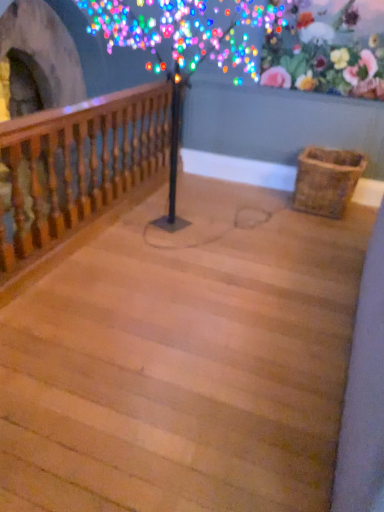
Question: Is floral fabric at upper right positioned beyond the bounds of wooden stairs at center?

Choices:
 (A) no
 (B) yes

Answer: (B)

Question: Considering the relative sizes of floral fabric at upper right and wooden stairs at center in the image provided, is floral fabric at upper right taller than wooden stairs at center?

Choices:
 (A) no
 (B) yes

Answer: (B)

Question: Is floral fabric at upper right wider than wooden stairs at center?

Choices:
 (A) no
 (B) yes

Answer: (A)

Question: From a real-world perspective, does floral fabric at upper right sit lower than wooden stairs at center?

Choices:
 (A) yes
 (B) no

Answer: (B)

Question: Does floral fabric at upper right appear on the left side of wooden stairs at center?

Choices:
 (A) no
 (B) yes

Answer: (A)

Question: From the image's perspective, is woven brown basket at lower right positioned above or below wooden stairs at center?

Choices:
 (A) below
 (B) above

Answer: (B)

Question: Considering the positions of point (314, 199) and point (279, 450), is point (314, 199) closer or farther from the camera than point (279, 450)?

Choices:
 (A) farther
 (B) closer

Answer: (A)

Question: Considering the positions of woven brown basket at lower right and wooden stairs at center in the image, is woven brown basket at lower right taller or shorter than wooden stairs at center?

Choices:
 (A) short
 (B) tall

Answer: (B)

Question: Based on their sizes in the image, would you say woven brown basket at lower right is bigger or smaller than wooden stairs at center?

Choices:
 (A) small
 (B) big

Answer: (A)

Question: From their relative heights in the image, would you say floral fabric at upper right is taller or shorter than wooden baluster at left?

Choices:
 (A) short
 (B) tall

Answer: (A)

Question: Is floral fabric at upper right wider or thinner than wooden baluster at left?

Choices:
 (A) wide
 (B) thin

Answer: (B)

Question: Does point (291, 47) appear closer or farther from the camera than point (6, 152)?

Choices:
 (A) farther
 (B) closer

Answer: (A)

Question: In the image, is floral fabric at upper right on the left side or the right side of wooden baluster at left?

Choices:
 (A) left
 (B) right

Answer: (B)

Question: In the image, is wooden baluster at left on the left side or the right side of woven brown basket at lower right?

Choices:
 (A) right
 (B) left

Answer: (B)

Question: From a real-world perspective, is wooden baluster at left above or below woven brown basket at lower right?

Choices:
 (A) below
 (B) above

Answer: (B)